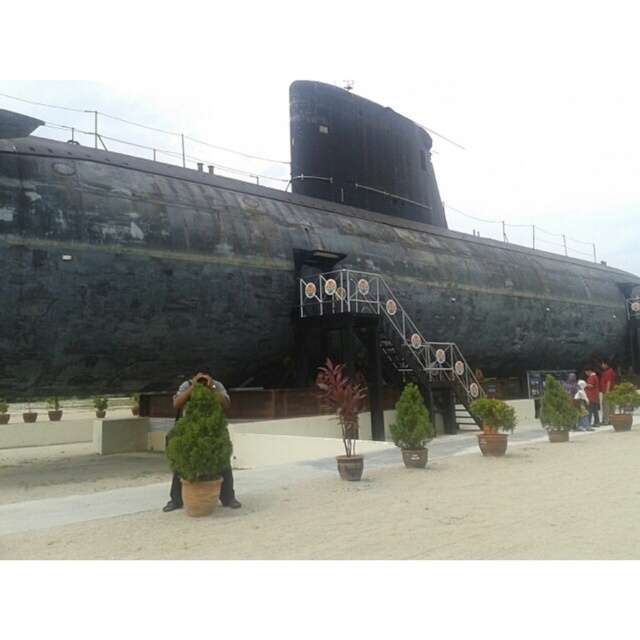
Question: Can you confirm if rusty metal battleship at center is thinner than light brown fabric shirt at center?

Choices:
 (A) yes
 (B) no

Answer: (B)

Question: Which point is closer to the camera?

Choices:
 (A) green leafy plant at center
 (B) light brown fabric shirt at center

Answer: (A)

Question: Estimate the real-world distances between objects in this image. Which object is closer to the rusty metal battleship at center?

Choices:
 (A) green leafy plant at center
 (B) light brown fabric shirt at center
 (C) red cotton shirt at center

Answer: (C)

Question: Among these points, which one is farthest from the camera?

Choices:
 (A) (221, 500)
 (B) (612, 381)
 (C) (449, 292)
 (D) (595, 387)

Answer: (C)

Question: Is rusty metal battleship at center above light brown fabric shirt at center?

Choices:
 (A) yes
 (B) no

Answer: (A)

Question: Is the position of rusty metal battleship at center less distant than that of green leafy plant at center?

Choices:
 (A) yes
 (B) no

Answer: (B)